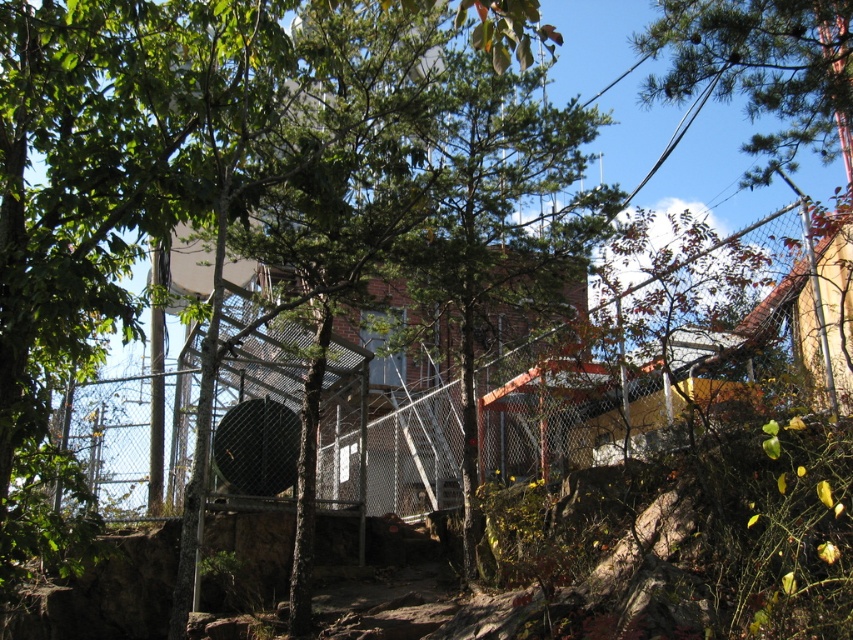
You are a painter standing at the edge of the greenery. You need to paint both the green leafy tree at center and the black matte basketball hoop at center. Which object will require you to lift your ladder higher to reach the top?

The green leafy tree at center has a greater height compared to the black matte basketball hoop at center, so you will need to lift your ladder higher to reach the top of the green leafy tree at center.